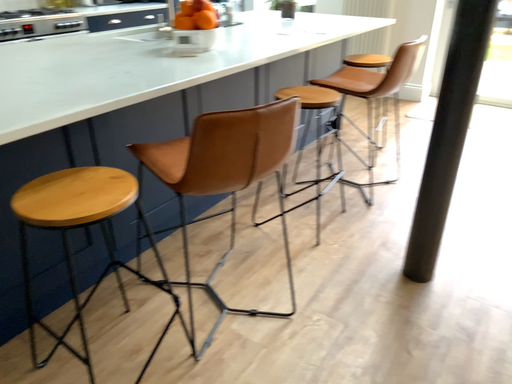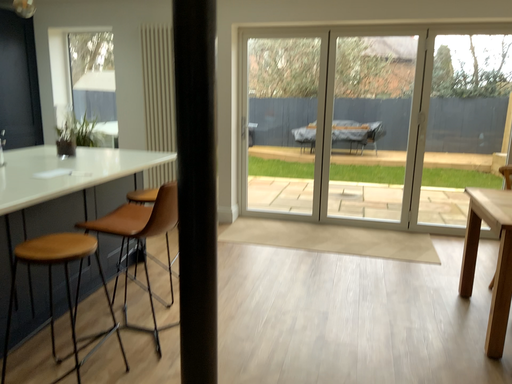
Question: How did the camera likely rotate when shooting the video?

Choices:
 (A) rotated right
 (B) rotated left

Answer: (A)